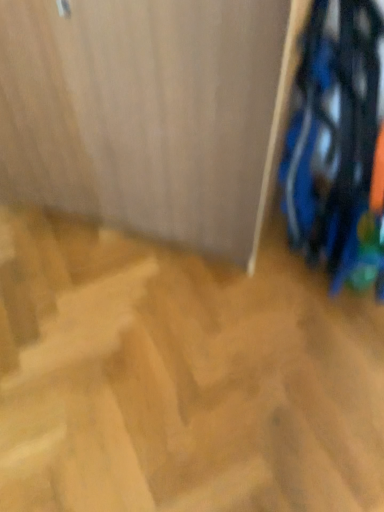
Identify the location of blue fabric laundry at right. (339, 145).

Image resolution: width=384 pixels, height=512 pixels. What do you see at coordinates (339, 145) in the screenshot?
I see `blue fabric laundry at right` at bounding box center [339, 145].

Where is `blue fabric laundry at right`? blue fabric laundry at right is located at coordinates (339, 145).